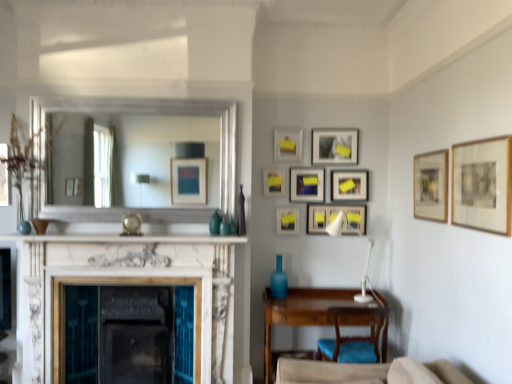
Question: Is silver/metallic mirror at upper center taller than matte black picture frame at center, which is the first picture frame from back to front?

Choices:
 (A) no
 (B) yes

Answer: (B)

Question: Is silver/metallic mirror at upper center bigger than matte black picture frame at center, which is the first picture frame from back to front?

Choices:
 (A) yes
 (B) no

Answer: (A)

Question: Is silver/metallic mirror at upper center beside matte black picture frame at center, which is the first picture frame from back to front?

Choices:
 (A) yes
 (B) no

Answer: (B)

Question: Is matte black picture frame at center, positioned as the 9th picture frame in front-to-back order, at the back of silver/metallic mirror at upper center?

Choices:
 (A) no
 (B) yes

Answer: (A)

Question: From the image's perspective, is silver/metallic mirror at upper center above matte black picture frame at center, positioned as the 9th picture frame in front-to-back order?

Choices:
 (A) no
 (B) yes

Answer: (B)

Question: Considering the positions of wooden framed picture at right, the eighth picture frame when ordered from back to front, and matte black picture frame at center, the eighth picture frame positioned from the front, in the image, is wooden framed picture at right, the eighth picture frame when ordered from back to front, bigger or smaller than matte black picture frame at center, the eighth picture frame positioned from the front,?

Choices:
 (A) small
 (B) big

Answer: (B)

Question: From the image's perspective, is wooden framed picture at right, the eighth picture frame when ordered from back to front, above or below matte black picture frame at center, which is the 2th picture frame from back to front?

Choices:
 (A) below
 (B) above

Answer: (B)

Question: Is wooden framed picture at right, placed as the second picture frame when sorted from front to back, taller or shorter than matte black picture frame at center, which is the 2th picture frame from back to front?

Choices:
 (A) tall
 (B) short

Answer: (A)

Question: Is point (444, 170) positioned closer to the camera than point (316, 205)?

Choices:
 (A) closer
 (B) farther

Answer: (A)

Question: From their relative heights in the image, would you say wooden desk at lower right is taller or shorter than white plastic lamp at center-right?

Choices:
 (A) tall
 (B) short

Answer: (A)

Question: Is wooden desk at lower right bigger or smaller than white plastic lamp at center-right?

Choices:
 (A) small
 (B) big

Answer: (B)

Question: From the image's perspective, is wooden desk at lower right positioned above or below white plastic lamp at center-right?

Choices:
 (A) above
 (B) below

Answer: (B)

Question: Would you say wooden desk at lower right is inside or outside white plastic lamp at center-right?

Choices:
 (A) outside
 (B) inside

Answer: (A)

Question: Is blue fabric chair at lower right inside the boundaries of white marble fireplace at center, or outside?

Choices:
 (A) outside
 (B) inside

Answer: (A)

Question: Is point (351, 355) positioned closer to the camera than point (99, 281)?

Choices:
 (A) closer
 (B) farther

Answer: (B)